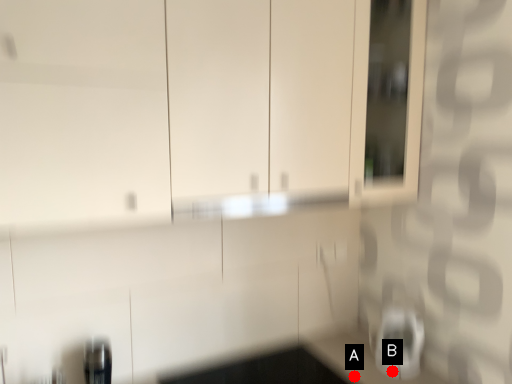
Question: Two points are circled on the image, labeled by A and B beside each circle. Which point is closer to the camera taking this photo?

Choices:
 (A) A is closer
 (B) B is closer

Answer: (A)